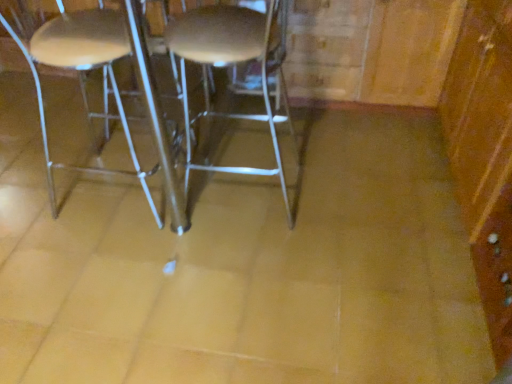
You are a GUI agent. You are given a task and a screenshot of the screen. Output one action in this format:
    pyautogui.click(x=<x>, y=<y>)
    Task: Click on the vacant space underneath metallic silver stool at left (from a real-world perspective)
    This screenshot has height=384, width=512.
    Given the screenshot: What is the action you would take?
    pyautogui.click(x=109, y=185)